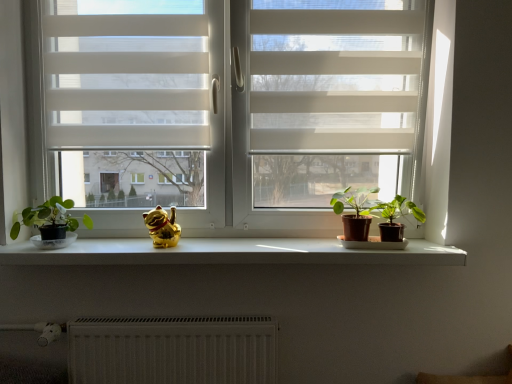
Question: From their relative heights in the image, would you say white matte window at center is taller or shorter than green matte plant at center, which is counted as the second houseplant, starting from the left?

Choices:
 (A) short
 (B) tall

Answer: (B)

Question: Considering the relative positions of white matte window at center and green matte plant at center, placed as the 2th houseplant when sorted from right to left, in the image provided, is white matte window at center to the left or to the right of green matte plant at center, placed as the 2th houseplant when sorted from right to left,?

Choices:
 (A) left
 (B) right

Answer: (A)

Question: Considering the real-world distances, which object is farthest from the white matte screen door at upper center?

Choices:
 (A) green matte houseplant at right, the third houseplant when ordered from left to right
 (B) white textured radiator at lower center
 (C) white smooth window sill at center
 (D) white matte window at center
 (E) green matte plant at center, placed as the 2th houseplant when sorted from right to left

Answer: (B)

Question: Which object is positioned closest to the green matte plant at left, the first houseplant viewed from the left?

Choices:
 (A) white smooth window sill at center
 (B) white matte window at center
 (C) gold shiny cat at center
 (D) white matte screen door at upper center
 (E) white sheer blinds at upper left

Answer: (A)